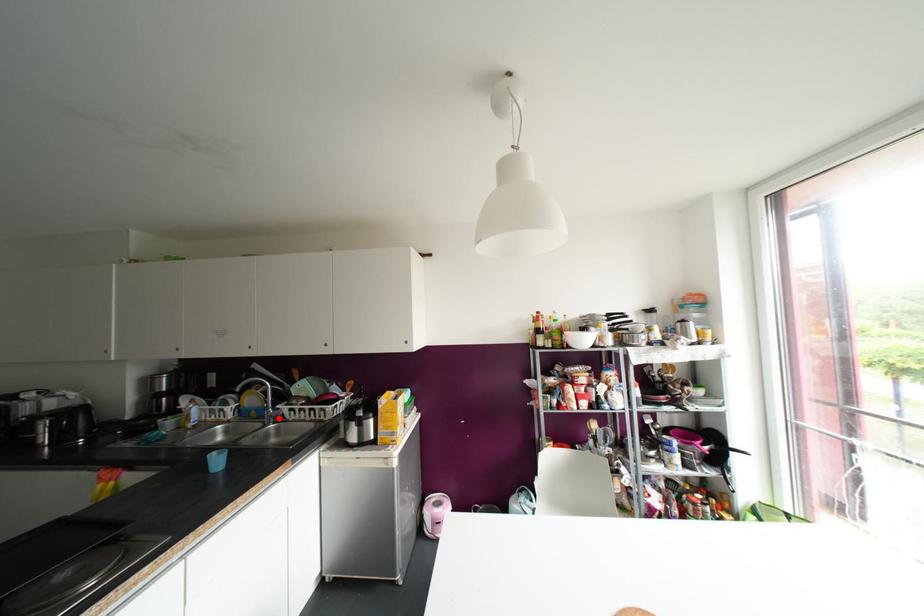
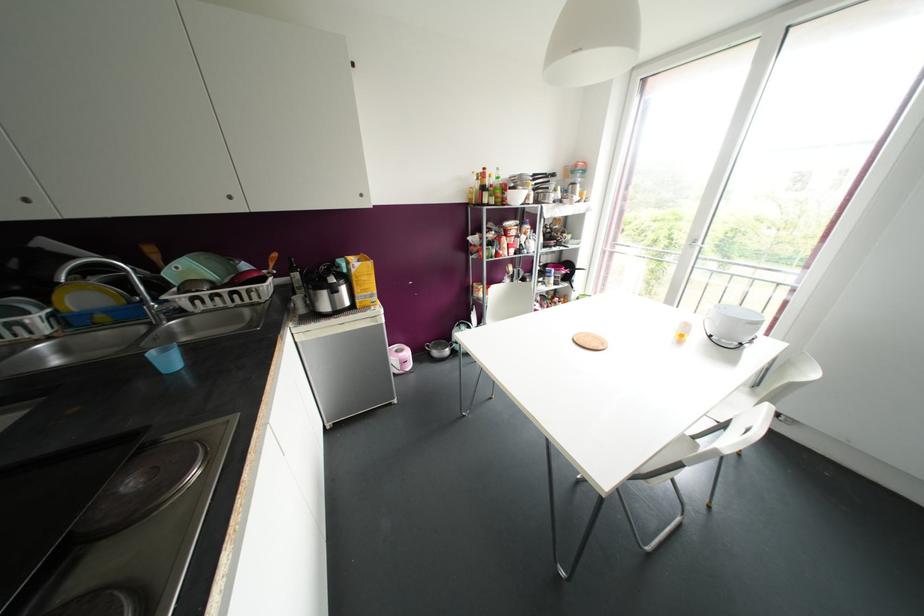
Question: I am providing you with two images of the same scene from different viewpoints. In image1, a red point is highlighted. Considering the same 3D point in image2, which of the following is correct?

Choices:
 (A) It is closer
 (B) It is farther

Answer: (A)